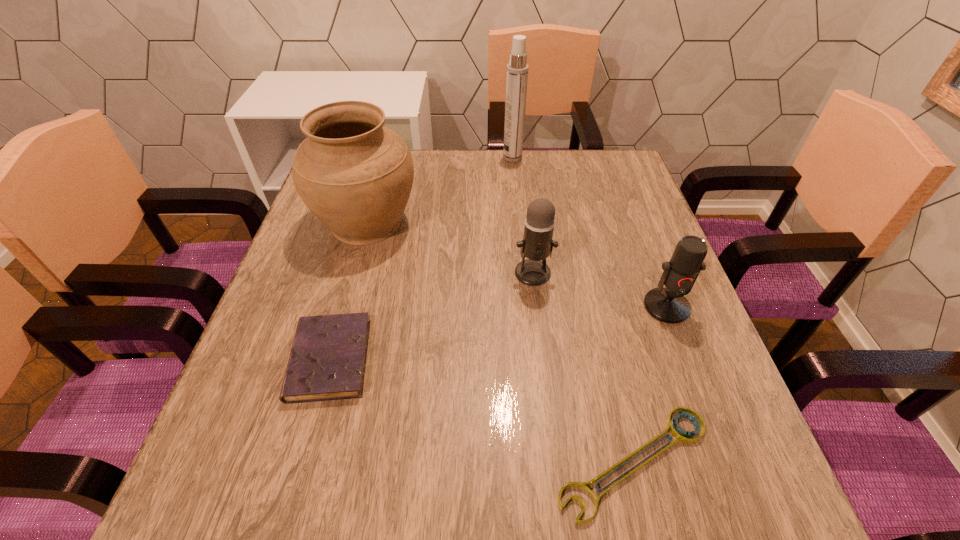
Image resolution: width=960 pixels, height=540 pixels. I want to click on vacant area that lies between the right microphone and the nearest object, so click(x=650, y=384).

Select which object is the fourth closest to the fifth tallest object. Please provide its 2D coordinates. Your answer should be formatted as a tuple, i.e. [(x, y)], where the tuple contains the x and y coordinates of a point satisfying the conditions above.

[(669, 305)]

This screenshot has width=960, height=540. I want to click on object that stands as the fifth closest to the fifth nearest object, so [x=669, y=305].

Find the location of a particular element. Image resolution: width=960 pixels, height=540 pixels. free space that satisfies the following two spatial constraints: 1. on the front side of the farther microphone; 2. on the left side of the urn is located at coordinates (352, 273).

Where is `vacant point that satisfies the following two spatial constraints: 1. on the front side of the urn; 2. on the left side of the fifth tallest object`? vacant point that satisfies the following two spatial constraints: 1. on the front side of the urn; 2. on the left side of the fifth tallest object is located at coordinates (328, 359).

Locate an element on the screen. This screenshot has height=540, width=960. vacant position in the image that satisfies the following two spatial constraints: 1. on the back side of the aerosol can; 2. on the left side of the urn is located at coordinates (385, 158).

Locate an element on the screen. The image size is (960, 540). vacant region that satisfies the following two spatial constraints: 1. on the front side of the left microphone; 2. on the right side of the fifth shortest object is located at coordinates (352, 273).